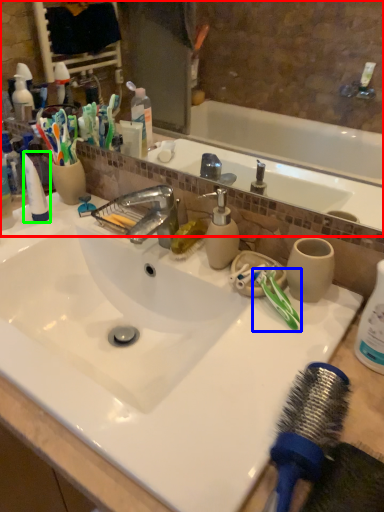
Question: Based on their relative distances, which object is farther from mirror (highlighted by a red box)? Choose from toothbrush (highlighted by a blue box) and toothpaste (highlighted by a green box).

Choices:
 (A) toothbrush
 (B) toothpaste

Answer: (A)